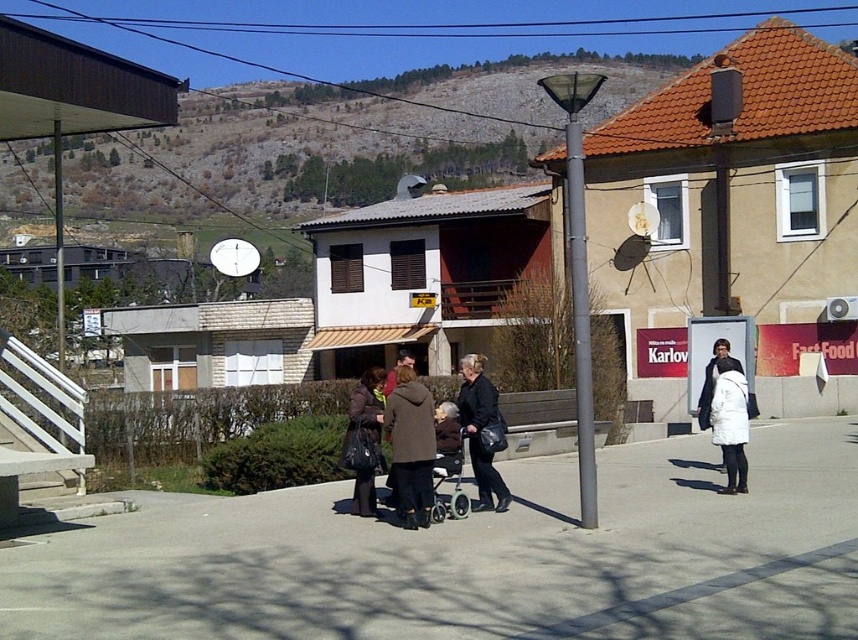
You are standing at the center of the image and want to walk towards the gray concrete pavement at center. Which direction should you go?

The gray concrete pavement at center is already at the center of the image, so you are already facing it. You don not need to change direction.

You are standing in the town square and want to take a photo of both the point at [440,589] and the point at [358,422]. Which point should you focus on first to ensure both are in focus?

You should focus on the point at [358,422] first because it is farther from the camera than the point at [440,589], ensuring both will be in focus when using the hyperfocal distance technique.

You are standing in the town square and see two coats at the center. Which coat is positioned lower between the brown wool coat at center and the dark gray coat at center?

The brown wool coat at center is located below the dark gray coat at center, so it is positioned lower.